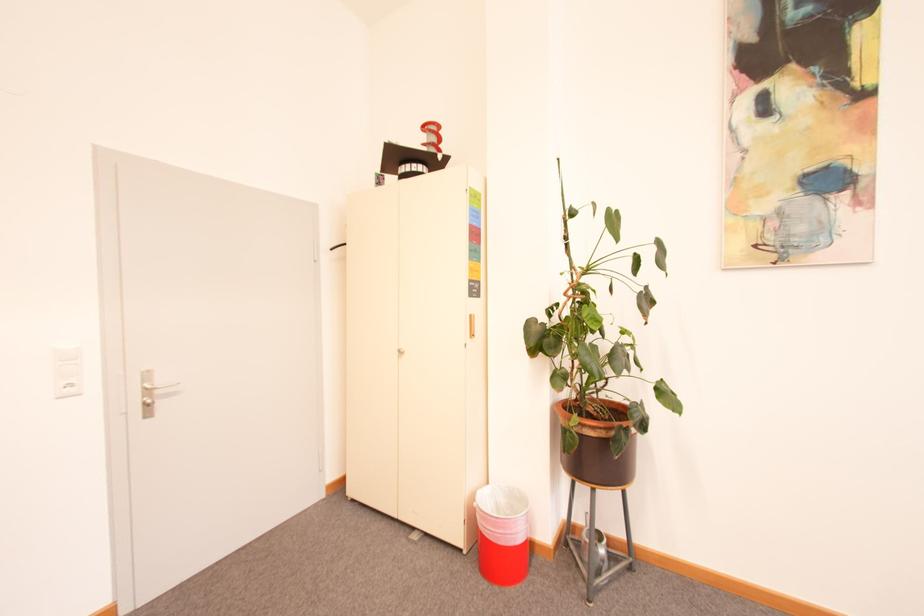
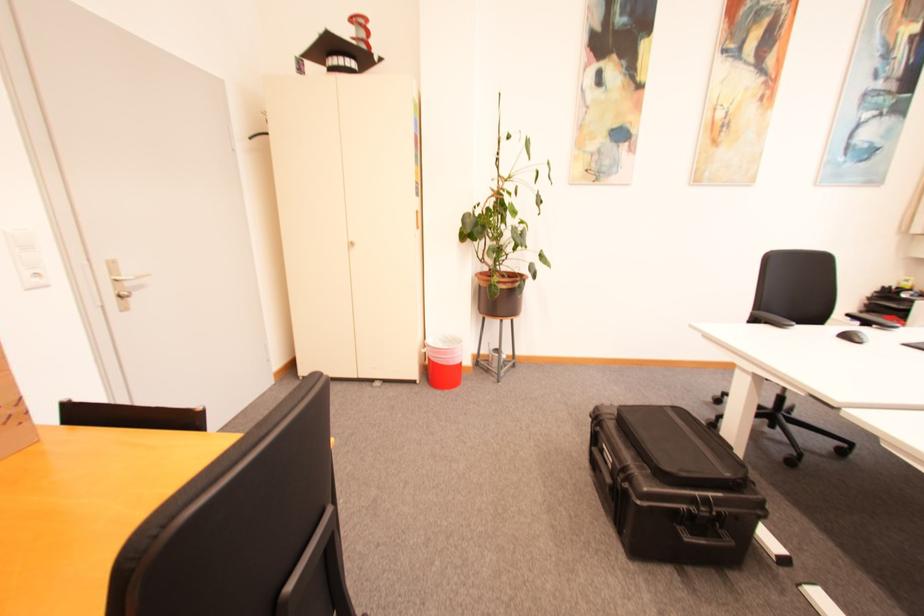
Find the pixel in the second image that matches (575,434) in the first image.

(500, 286)